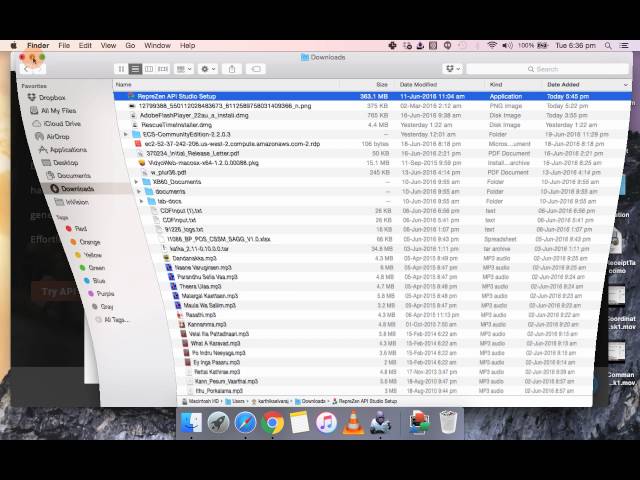
Locate an element on the screen. Image resolution: width=640 pixels, height=480 pixels. folders is located at coordinates (139, 133), (150, 183), (150, 194), (154, 204).